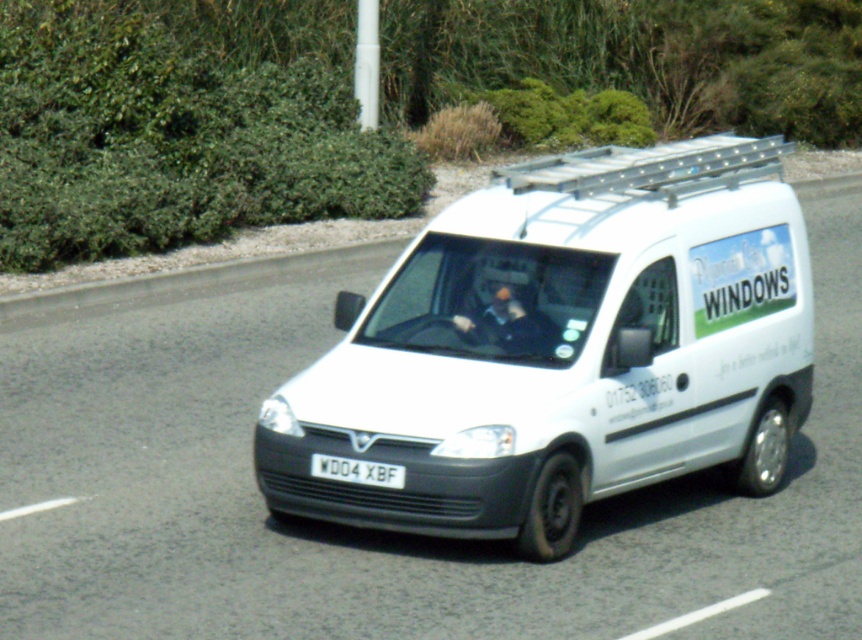
You are a driver approaching the white van. You notice a green leafy hedge at upper left located at point (170, 140). Is the hedge closer to the van or to the background shrubs?

The green leafy hedge at upper left located at point (170, 140) is part of the background shrubs, so it is closer to the background shrubs than the van.

You are a delivery driver who needs to attach a GPS tracker to the roof rack of the white matte van at center. The GPS tracker requires a minimum of 1.5 meters of clearance from the white plastic license plate at center to function properly. Based on the image, will the GPS tracker work if placed on the roof rack?

The distance between the white matte van at center and the white plastic license plate at center is 1.29 meters. Since the required clearance is 1.5 meters, the GPS tracker will not have enough clearance and may not function properly.

You are a photographer trying to capture the van from a specific angle. You notice two points marked in the scene. Which of the two points, point (x=211, y=150) or point (x=365, y=461), is closer to your camera position?

Point (x=365, y=461) is closer to the camera because it is less further than point (x=211, y=150).